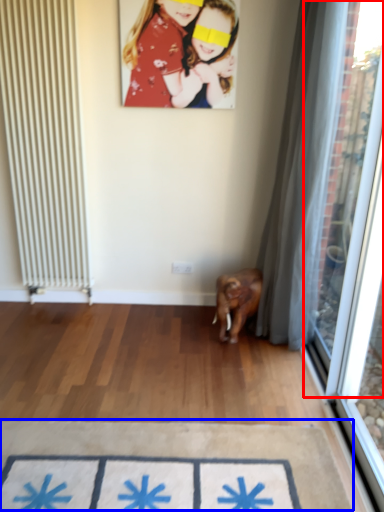
Question: Which of the following is the farthest to the observer, window screen (highlighted by a red box) or doormat (highlighted by a blue box)?

Choices:
 (A) window screen
 (B) doormat

Answer: (B)